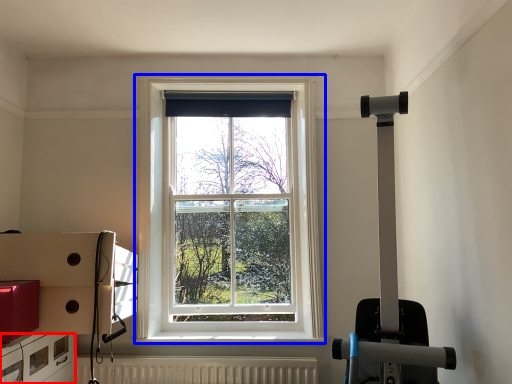
Question: Which object is further to the camera taking this photo, drawer (highlighted by a red box) or window (highlighted by a blue box)?

Choices:
 (A) drawer
 (B) window

Answer: (B)